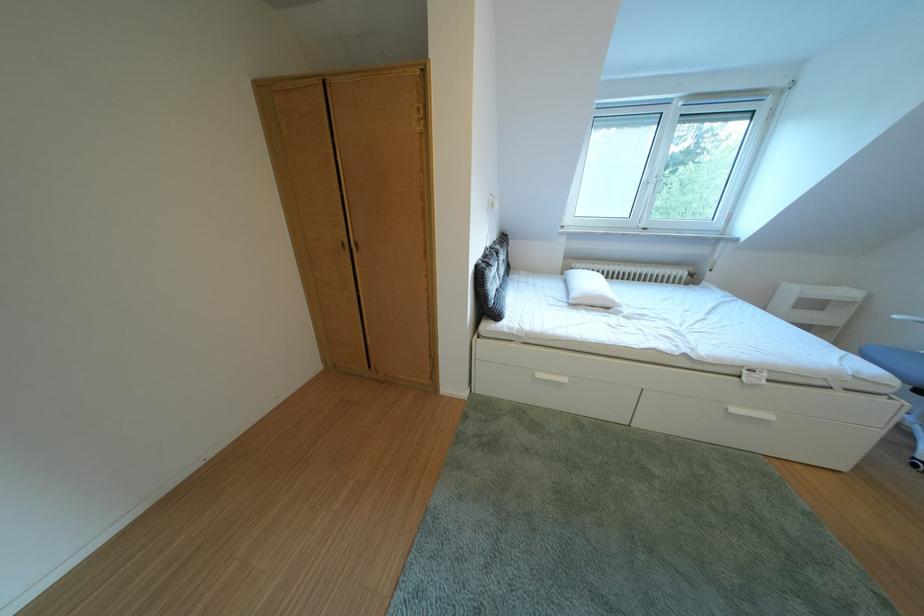
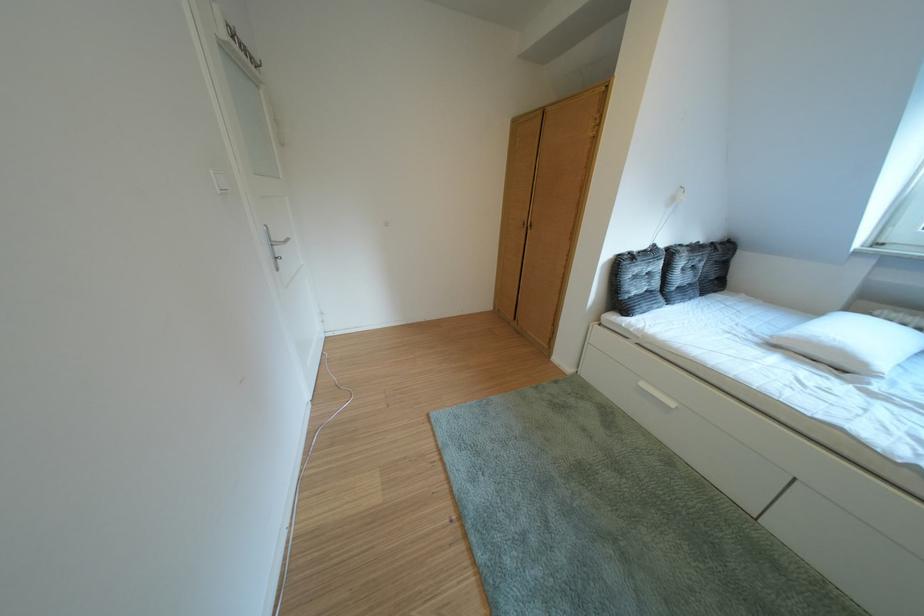
Question: The camera is either moving clockwise (left) or counter-clockwise (right) around the object. The first image is from the beginning of the video and the second image is from the end. Is the camera moving left or right when shooting the video?

Choices:
 (A) Left
 (B) Right

Answer: (B)